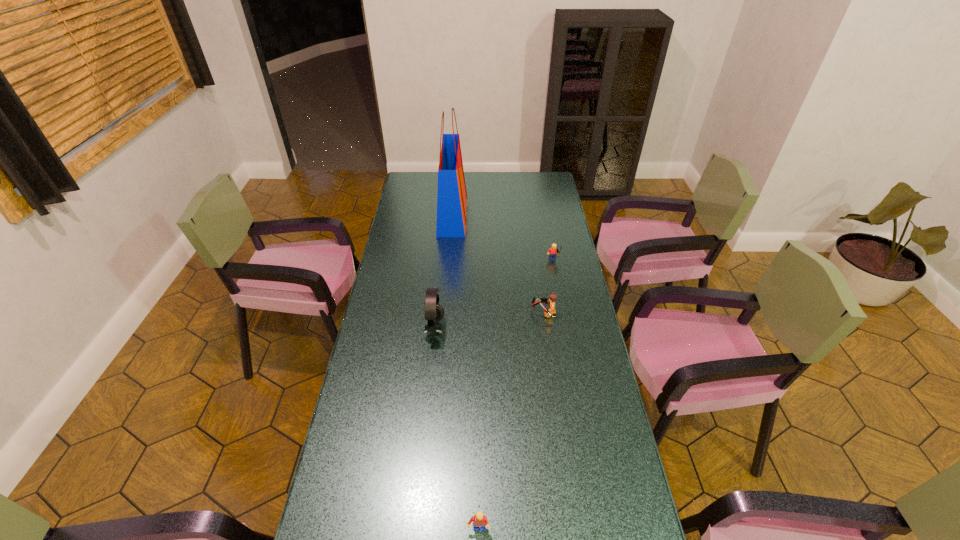
In order to click on free area in between the shortest object and the second farthest Lego in this screenshot , I will do [x=511, y=421].

In order to click on vacant area that lies between the leftmost Lego and the second nearest Lego in this screenshot , I will do `click(511, 421)`.

This screenshot has width=960, height=540. I want to click on vacant space that's between the earphone and the second farthest Lego, so click(x=489, y=321).

Find the location of a particular element. vacant point located between the fourth shortest object and the fourth object from left to right is located at coordinates (489, 321).

This screenshot has width=960, height=540. I want to click on unoccupied position between the tallest object and the farthest Lego, so click(503, 239).

You are a GUI agent. You are given a task and a screenshot of the screen. Output one action in this format:
    pyautogui.click(x=<x>, y=<y>)
    Task: Click on the vacant space in between the rightmost Lego and the second tallest object
    Image resolution: width=960 pixels, height=540 pixels.
    Given the screenshot: What is the action you would take?
    pyautogui.click(x=494, y=295)

The height and width of the screenshot is (540, 960). Identify the location of vacant space that's between the fourth object from left to right and the tallest object. (498, 265).

Locate an element on the screen. vacant area that lies between the rightmost object and the tallest object is located at coordinates (503, 239).

I want to click on free space between the shopping bag and the nearest Lego, so click(x=466, y=373).

The image size is (960, 540). I want to click on vacant area between the second nearest Lego and the earphone, so click(489, 321).